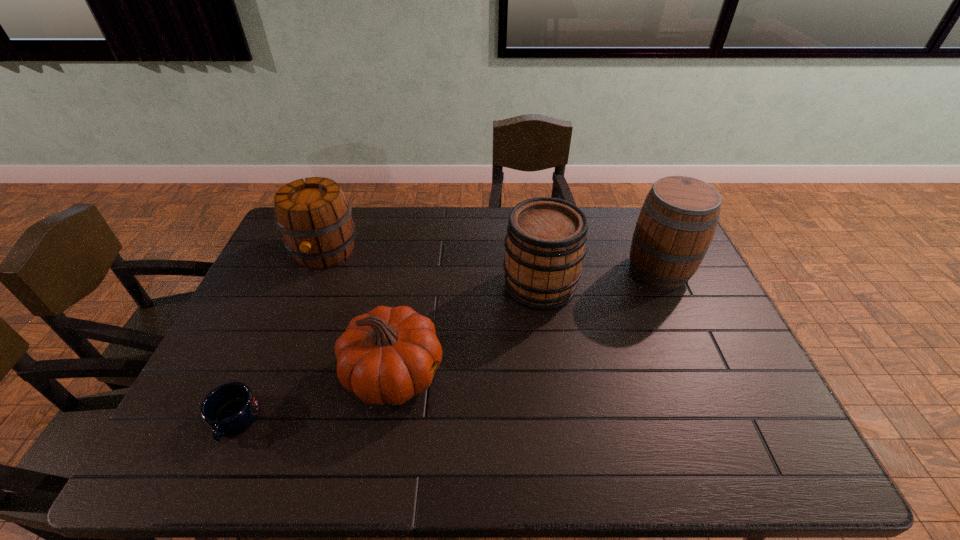
Find the location of a particular element. The image size is (960, 540). the rightmost object is located at coordinates (677, 222).

You are a GUI agent. You are given a task and a screenshot of the screen. Output one action in this format:
    pyautogui.click(x=<x>, y=<y>)
    Task: Click on the fourth object from left to right
    
    Given the screenshot: What is the action you would take?
    pyautogui.click(x=545, y=243)

Where is `the leftmost cider`? the leftmost cider is located at coordinates (314, 217).

Where is `the third object from right to left`? the third object from right to left is located at coordinates (385, 356).

I want to click on mug, so click(229, 409).

Where is `free spot located on the left of the rightmost object`? This screenshot has height=540, width=960. free spot located on the left of the rightmost object is located at coordinates (507, 270).

This screenshot has width=960, height=540. Identify the location of vacant position located 0.280m on the front of the second cider from left to right. (556, 397).

You are a GUI agent. You are given a task and a screenshot of the screen. Output one action in this format:
    pyautogui.click(x=<x>, y=<y>)
    Task: Click on the vacant space located 0.210m on the side of the leftmost cider where the spigot is located
    
    Given the screenshot: What is the action you would take?
    pyautogui.click(x=294, y=326)

Where is `vacant space located on the face of the third object from right to left`? Image resolution: width=960 pixels, height=540 pixels. vacant space located on the face of the third object from right to left is located at coordinates (471, 374).

You are a GUI agent. You are given a task and a screenshot of the screen. Output one action in this format:
    pyautogui.click(x=<x>, y=<y>)
    Task: Click on the object located at the far edge
    This screenshot has height=540, width=960.
    Given the screenshot: What is the action you would take?
    pyautogui.click(x=314, y=217)